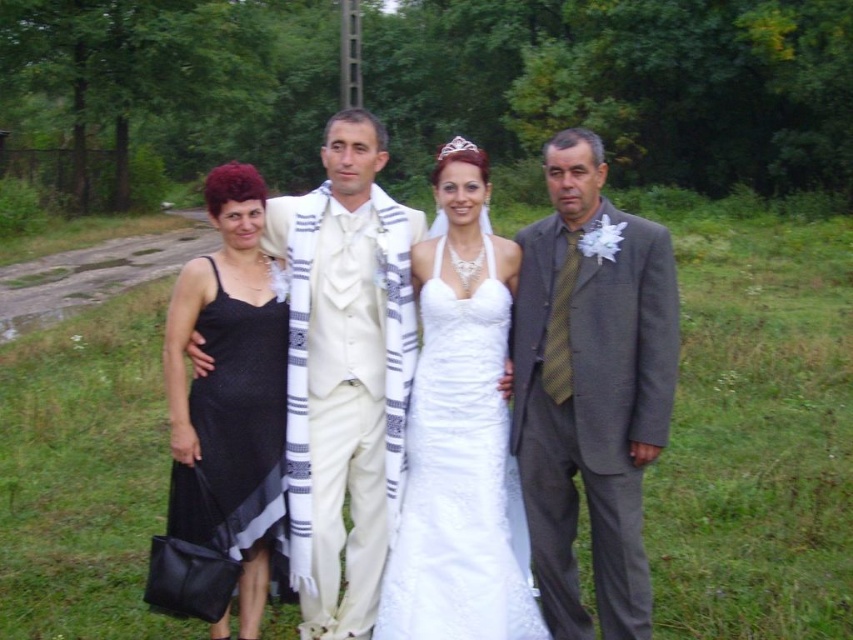
Question: Estimate the real-world distances between objects in this image. Which object is closer to the white satin dress at center?

Choices:
 (A) gray textured suit at right
 (B) white lace dress at center

Answer: (A)

Question: Which object appears farthest from the camera in this image?

Choices:
 (A) white satin dress at center
 (B) silver metallic tiara at upper center

Answer: (B)

Question: Can you confirm if white satin suit at center is positioned above silver metallic tiara at upper center?

Choices:
 (A) yes
 (B) no

Answer: (B)

Question: Is white satin dress at center thinner than gray textured suit at right?

Choices:
 (A) no
 (B) yes

Answer: (A)

Question: Does black satin dress at left appear over silver metallic tiara at upper center?

Choices:
 (A) yes
 (B) no

Answer: (B)

Question: Which point is closer to the camera taking this photo?

Choices:
 (A) (364, 586)
 (B) (625, 371)
 (C) (437, 157)

Answer: (B)